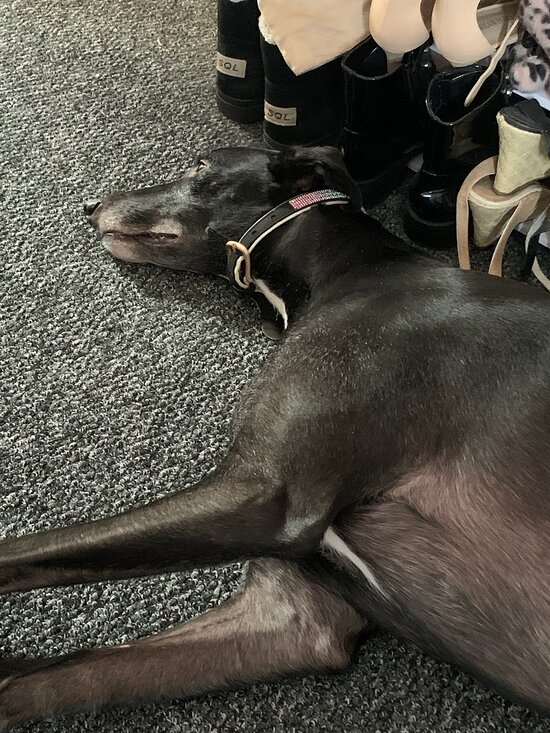
This screenshot has height=733, width=550. I want to click on carpet, so click(x=50, y=119).